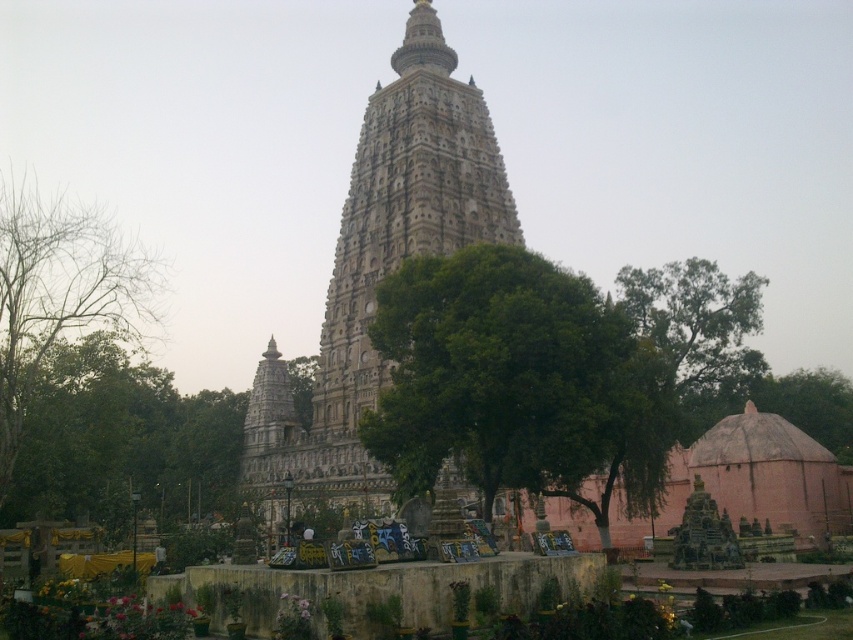
Which is behind, point (509, 316) or point (431, 141)?

Point (431, 141)

Can you confirm if green leafy tree at center is thinner than stone carved tower at center?

Yes, green leafy tree at center is thinner than stone carved tower at center.

The height and width of the screenshot is (640, 853). In order to click on green leafy tree at center in this screenshot , I will do `click(517, 381)`.

Which of these two, stone carved tower at center or green leafy tree at left, stands shorter?

With less height is green leafy tree at left.

What do you see at coordinates (379, 268) in the screenshot? I see `stone carved tower at center` at bounding box center [379, 268].

Locate an element on the screen. Image resolution: width=853 pixels, height=640 pixels. stone carved tower at center is located at coordinates (379, 268).

You are a GUI agent. You are given a task and a screenshot of the screen. Output one action in this format:
    pyautogui.click(x=<x>, y=<y>)
    Task: Click on the stone carved tower at center
    The image size is (853, 640).
    Given the screenshot: What is the action you would take?
    pyautogui.click(x=379, y=268)

Is stone carved tower at center positioned behind bare branches at left?

No, it is in front of bare branches at left.

Measure the distance between point (361, 225) and camera.

Point (361, 225) and camera are 358.91 feet apart from each other.

In the scene shown: Who is more distant from viewer, (334, 397) or (91, 296)?

The point (91, 296) is behind.

At what (x,y) coordinates should I click in order to perform the action: click on stone carved tower at center. Please return your answer as a coordinate pair (x, y). The width and height of the screenshot is (853, 640). Looking at the image, I should click on (379, 268).